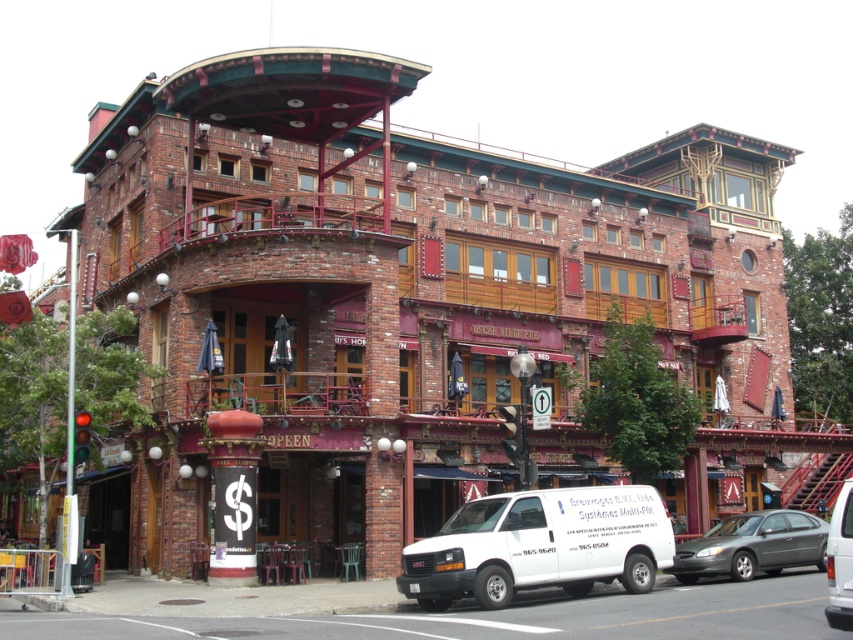
Is white matte van at lower center wider than white matte van at center?

No, white matte van at lower center is not wider than white matte van at center.

Is white matte van at lower center thinner than white matte van at center?

Indeed, white matte van at lower center has a lesser width compared to white matte van at center.

Identify the location of white matte van at lower center. (540, 545).

Does point (758, 515) come behind point (843, 566)?

That is True.

Who is more distant from viewer, (682, 580) or (837, 600)?

Positioned behind is point (682, 580).

Where is `metallic gray sedan at lower right`? metallic gray sedan at lower right is located at coordinates (x=752, y=545).

The height and width of the screenshot is (640, 853). I want to click on white matte van at lower center, so click(x=540, y=545).

Which is above, white matte van at lower center or metallic gray sedan at lower right?

white matte van at lower center

Locate an element on the screen. white matte van at lower center is located at coordinates (540, 545).